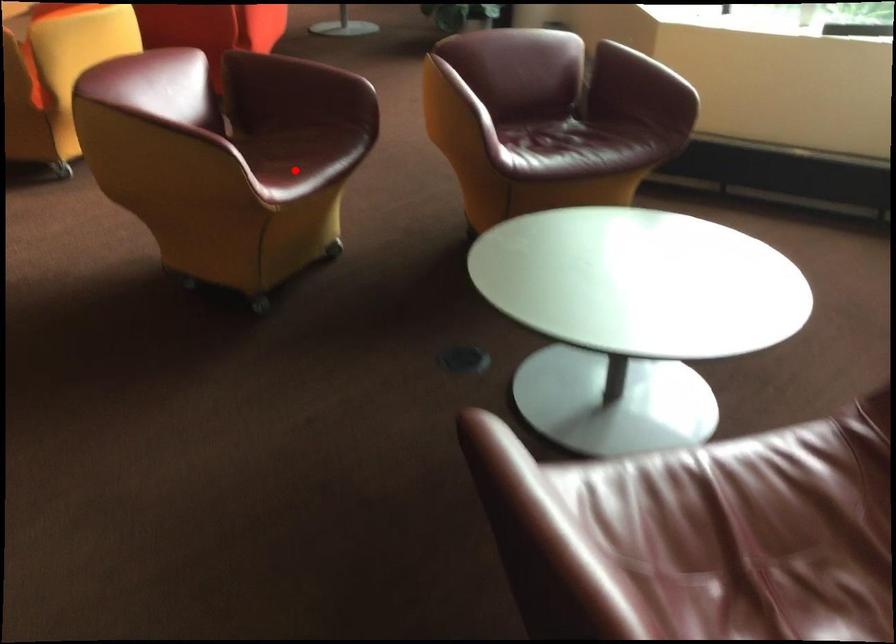
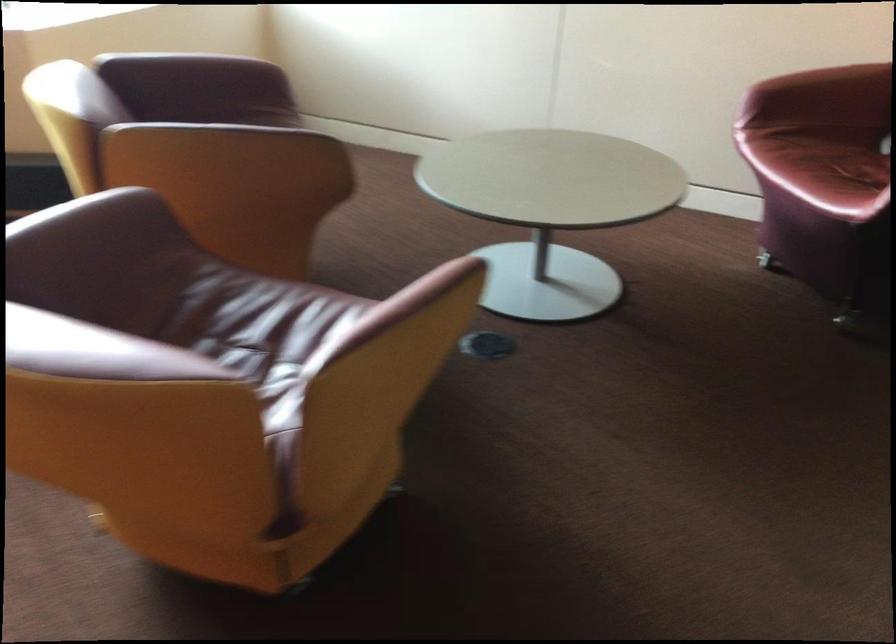
Question: I am providing you with two images of the same scene from different viewpoints. Given a red point in image1, look at the same physical point in image2. Is it:

Choices:
 (A) Closer to the viewpoint
 (B) Farther from the viewpoint

Answer: (A)